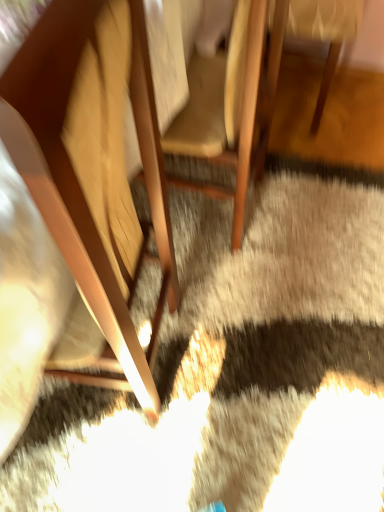
What is the approximate width of wooden chair at left, the 1th chair viewed from the left?

13.78 inches.

Locate an element on the screen. This screenshot has width=384, height=512. wooden chair at center, the 1th chair positioned from the right is located at coordinates (324, 34).

Could you tell me if wooden chair at left, the 1th chair viewed from the left, is facing wooden chair at center, placed as the third chair when sorted from left to right?

No, wooden chair at left, the 1th chair viewed from the left, is not turned towards wooden chair at center, placed as the third chair when sorted from left to right.

Considering the sizes of objects wooden chair at left, which is the third chair in right-to-left order, and wooden chair at center, placed as the third chair when sorted from left to right, in the image provided, who is shorter, wooden chair at left, which is the third chair in right-to-left order, or wooden chair at center, placed as the third chair when sorted from left to right,?

Standing shorter between the two is wooden chair at center, placed as the third chair when sorted from left to right.

Image resolution: width=384 pixels, height=512 pixels. Identify the location of the 2nd chair below the wooden chair at center, placed as the third chair when sorted from left to right (from the image's perspective). (93, 178).

Looking at this image, considering the relative sizes of wooden chair at left, which is the third chair in right-to-left order, and wooden chair at center, placed as the third chair when sorted from left to right, in the image provided, is wooden chair at left, which is the third chair in right-to-left order, bigger than wooden chair at center, placed as the third chair when sorted from left to right,?

Yes.

Is wooden chair at left, the 1th chair viewed from the left, far away from wooden chair at center, which appears as the second chair when viewed from the left?

No, there isn't a large distance between wooden chair at left, the 1th chair viewed from the left, and wooden chair at center, which appears as the second chair when viewed from the left.

Between wooden chair at left, which is the third chair in right-to-left order, and wooden chair at center, which appears as the second chair when viewed from the left, which one has larger width?

With larger width is wooden chair at center, which appears as the second chair when viewed from the left.

Which point is more forward, (65,362) or (256,170)?

The point (65,362) is closer to the camera.

Does wooden chair at left, which is the third chair in right-to-left order, come in front of wooden chair at center, which appears as the second chair when viewed from the left?

Yes, wooden chair at left, which is the third chair in right-to-left order, is in front of wooden chair at center, which appears as the second chair when viewed from the left.

Considering the points (242, 26) and (297, 34), which point is behind, point (242, 26) or point (297, 34)?

The point (297, 34) is farther from the camera.

Which is more to the right, wooden chair at center, the second chair in the right-to-left sequence, or wooden chair at center, placed as the third chair when sorted from left to right?

From the viewer's perspective, wooden chair at center, placed as the third chair when sorted from left to right, appears more on the right side.

Starting from the wooden chair at center, placed as the third chair when sorted from left to right, which chair is the 1st one in front? Please provide its 2D coordinates.

[(231, 105)]

From the image's perspective, which is below, wooden chair at center, which appears as the second chair when viewed from the left, or wooden chair at center, the 1th chair positioned from the right?

wooden chair at center, which appears as the second chair when viewed from the left.

Is wooden chair at center, the second chair in the right-to-left sequence, aimed at wooden chair at left, which is the third chair in right-to-left order?

No, wooden chair at center, the second chair in the right-to-left sequence, is not turned towards wooden chair at left, which is the third chair in right-to-left order.

Considering the relative sizes of wooden chair at center, the second chair in the right-to-left sequence, and wooden chair at left, which is the third chair in right-to-left order, in the image provided, is wooden chair at center, the second chair in the right-to-left sequence, smaller than wooden chair at left, which is the third chair in right-to-left order,?

Correct, wooden chair at center, the second chair in the right-to-left sequence, occupies less space than wooden chair at left, which is the third chair in right-to-left order.

From the picture: Can you confirm if wooden chair at center, which appears as the second chair when viewed from the left, is taller than wooden chair at left, the 1th chair viewed from the left?

Incorrect, the height of wooden chair at center, which appears as the second chair when viewed from the left, is not larger of that of wooden chair at left, the 1th chair viewed from the left.

From the wooden chair at left, the 1th chair viewed from the left, count 2nd chair to the right and point to it. Please provide its 2D coordinates.

[(324, 34)]

In terms of height, does wooden chair at center, placed as the third chair when sorted from left to right, look taller or shorter compared to wooden chair at left, which is the third chair in right-to-left order?

Clearly, wooden chair at center, placed as the third chair when sorted from left to right, is shorter compared to wooden chair at left, which is the third chair in right-to-left order.

Between wooden chair at center, the 1th chair positioned from the right, and wooden chair at left, which is the third chair in right-to-left order, which one has larger width?

Wider between the two is wooden chair at center, the 1th chair positioned from the right.

Does wooden chair at center, the 1th chair positioned from the right, lie behind wooden chair at left, which is the third chair in right-to-left order?

Yes, it is behind wooden chair at left, which is the third chair in right-to-left order.

Is wooden chair at center, placed as the third chair when sorted from left to right, oriented towards wooden chair at center, the second chair in the right-to-left sequence?

Yes, wooden chair at center, placed as the third chair when sorted from left to right, is oriented towards wooden chair at center, the second chair in the right-to-left sequence.

Between wooden chair at center, placed as the third chair when sorted from left to right, and wooden chair at center, the second chair in the right-to-left sequence, which one has smaller width?

wooden chair at center, the second chair in the right-to-left sequence.

Find the location of a particular element. chair on the right of wooden chair at center, which appears as the second chair when viewed from the left is located at coordinates (324, 34).

Which object is closer to the camera taking this photo, wooden chair at center, the 1th chair positioned from the right, or wooden chair at center, the second chair in the right-to-left sequence?

wooden chair at center, the second chair in the right-to-left sequence.

This screenshot has height=512, width=384. What are the coordinates of `the 2nd chair above the wooden chair at left, which is the third chair in right-to-left order (from the image's perspective)` in the screenshot? It's located at (324, 34).

From a real-world perspective, which chair is the 1st one underneath the wooden chair at left, which is the third chair in right-to-left order? Please provide its 2D coordinates.

[(231, 105)]

When comparing their distances from wooden chair at center, the 1th chair positioned from the right, does wooden chair at left, which is the third chair in right-to-left order, or wooden chair at center, the second chair in the right-to-left sequence, seem further?

→ wooden chair at left, which is the third chair in right-to-left order, is positioned further to the anchor wooden chair at center, the 1th chair positioned from the right.

Considering their positions, is wooden chair at center, the 1th chair positioned from the right, positioned closer to wooden chair at left, the 1th chair viewed from the left, than wooden chair at center, which appears as the second chair when viewed from the left?

wooden chair at center, which appears as the second chair when viewed from the left.

Estimate the real-world distances between objects in this image. Which object is further from wooden chair at center, the 1th chair positioned from the right, wooden chair at center, the second chair in the right-to-left sequence, or wooden chair at left, which is the third chair in right-to-left order?

wooden chair at left, which is the third chair in right-to-left order, is further to wooden chair at center, the 1th chair positioned from the right.

From the image, which object appears to be nearer to wooden chair at center, the second chair in the right-to-left sequence, wooden chair at left, which is the third chair in right-to-left order, or wooden chair at center, the 1th chair positioned from the right?

wooden chair at center, the 1th chair positioned from the right.

Which object lies further to the anchor point wooden chair at center, the second chair in the right-to-left sequence, wooden chair at center, placed as the third chair when sorted from left to right, or wooden chair at left, which is the third chair in right-to-left order?

wooden chair at left, which is the third chair in right-to-left order.

Estimate the real-world distances between objects in this image. Which object is further from wooden chair at left, the 1th chair viewed from the left, wooden chair at center, which appears as the second chair when viewed from the left, or wooden chair at center, the 1th chair positioned from the right?

wooden chair at center, the 1th chair positioned from the right, lies further to wooden chair at left, the 1th chair viewed from the left, than the other object.

At what (x,y) coordinates should I click in order to perform the action: click on chair between wooden chair at left, the 1th chair viewed from the left, and wooden chair at center, the 1th chair positioned from the right, in the front-back direction. Please return your answer as a coordinate pair (x, y). Image resolution: width=384 pixels, height=512 pixels. Looking at the image, I should click on (231, 105).